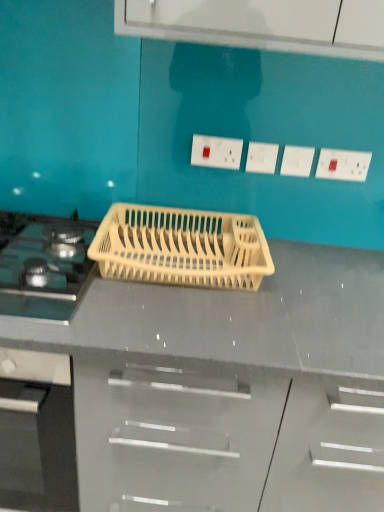
Question: From the image's perspective, is beige plastic dish rack at center located beneath white plastic electric outlet at upper center, the third electric outlet viewed from the right?

Choices:
 (A) no
 (B) yes

Answer: (B)

Question: Does beige plastic dish rack at center appear on the right side of white plastic electric outlet at upper center, the third electric outlet viewed from the right?

Choices:
 (A) yes
 (B) no

Answer: (B)

Question: Is beige plastic dish rack at center outside white plastic electric outlet at upper center, which is the second electric outlet from left to right?

Choices:
 (A) yes
 (B) no

Answer: (A)

Question: From a real-world perspective, is beige plastic dish rack at center located higher than white plastic electric outlet at upper center, the third electric outlet viewed from the right?

Choices:
 (A) no
 (B) yes

Answer: (A)

Question: Is beige plastic dish rack at center aimed at white plastic electric outlet at upper center, the third electric outlet viewed from the right?

Choices:
 (A) yes
 (B) no

Answer: (B)

Question: Relative to white plastic electric outlet at upper right, which appears as the 1th electric outlet when viewed from the right, is matte black gas stove at left in front or behind?

Choices:
 (A) behind
 (B) front

Answer: (B)

Question: From a real-world perspective, relative to white plastic electric outlet at upper right, positioned as the 4th electric outlet in left-to-right order, is matte black gas stove at left vertically above or below?

Choices:
 (A) above
 (B) below

Answer: (B)

Question: Is point (49, 254) closer or farther from the camera than point (327, 165)?

Choices:
 (A) closer
 (B) farther

Answer: (A)

Question: Considering the positions of matte black gas stove at left and white plastic electric outlet at upper right, positioned as the 4th electric outlet in left-to-right order, in the image, is matte black gas stove at left taller or shorter than white plastic electric outlet at upper right, positioned as the 4th electric outlet in left-to-right order,?

Choices:
 (A) short
 (B) tall

Answer: (A)

Question: Is point (190, 238) closer or farther from the camera than point (259, 147)?

Choices:
 (A) closer
 (B) farther

Answer: (A)

Question: From a real-world perspective, is beige plastic dish rack at center physically located above or below white plastic electric outlet at upper center, which is the second electric outlet from left to right?

Choices:
 (A) below
 (B) above

Answer: (A)

Question: Is beige plastic dish rack at center spatially inside white plastic electric outlet at upper center, the third electric outlet viewed from the right, or outside of it?

Choices:
 (A) outside
 (B) inside

Answer: (A)

Question: Looking at their shapes, would you say beige plastic dish rack at center is wider or thinner than white plastic electric outlet at upper center, which is the second electric outlet from left to right?

Choices:
 (A) thin
 (B) wide

Answer: (B)

Question: From a real-world perspective, is white plastic electric outlet at upper center, the second electric outlet from the right, physically located above or below white plastic electric outlet at center, the first electric outlet from the left?

Choices:
 (A) above
 (B) below

Answer: (B)

Question: Based on their sizes in the image, would you say white plastic electric outlet at upper center, the second electric outlet from the right, is bigger or smaller than white plastic electric outlet at center, arranged as the fourth electric outlet when viewed from the right?

Choices:
 (A) big
 (B) small

Answer: (B)